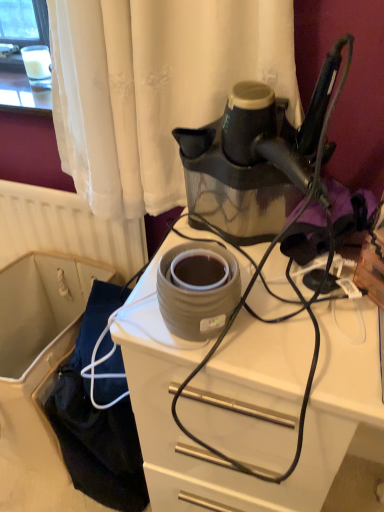
Image resolution: width=384 pixels, height=512 pixels. I want to click on free point below black rubber cord at center (from a real-world perspective), so click(251, 250).